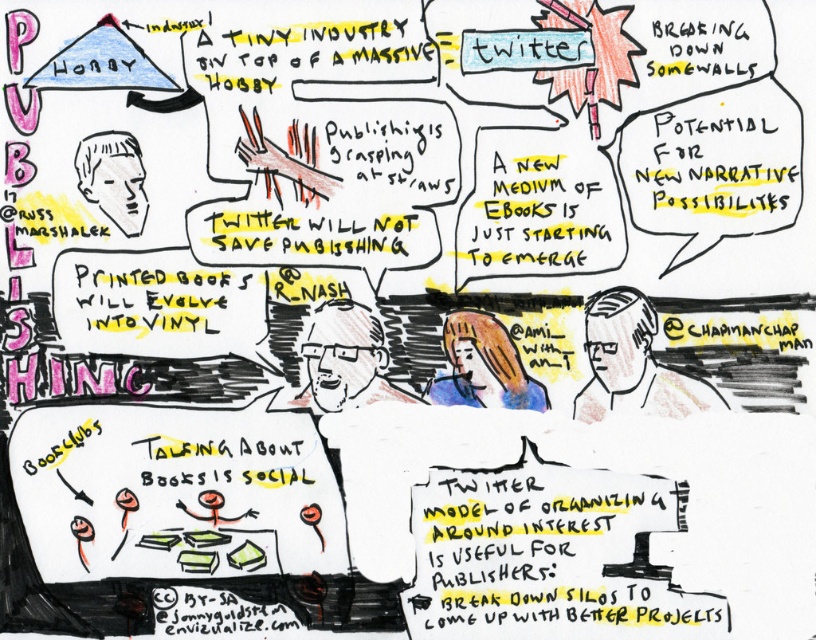
Who is more forward, (712, 387) or (471, 314)?

Point (712, 387) is in front.

Is gray textured shirt at center right wider than blue fabric face at center?

Yes.

Is point (588, 349) farther from viewer compared to point (471, 332)?

No, (588, 349) is closer to viewer.

Where is `gray textured shirt at center right`? gray textured shirt at center right is located at coordinates (x=633, y=364).

Find the location of a particular element. Image resolution: width=816 pixels, height=640 pixels. gray textured shirt at center right is located at coordinates pyautogui.click(x=633, y=364).

Can you confirm if gray textured shirt at center right is positioned above light brown paper at upper left?

No, gray textured shirt at center right is not above light brown paper at upper left.

In order to click on gray textured shirt at center right in this screenshot , I will do `click(633, 364)`.

Is blue fabric face at center below light brown paper at upper left?

Indeed, blue fabric face at center is positioned under light brown paper at upper left.

Between blue fabric face at center and light brown paper at upper left, which one appears on the right side from the viewer's perspective?

blue fabric face at center is more to the right.

Measure the distance between point (442, 403) and camera.

They are 3.95 feet apart.

This screenshot has height=640, width=816. Identify the location of blue fabric face at center. (482, 365).